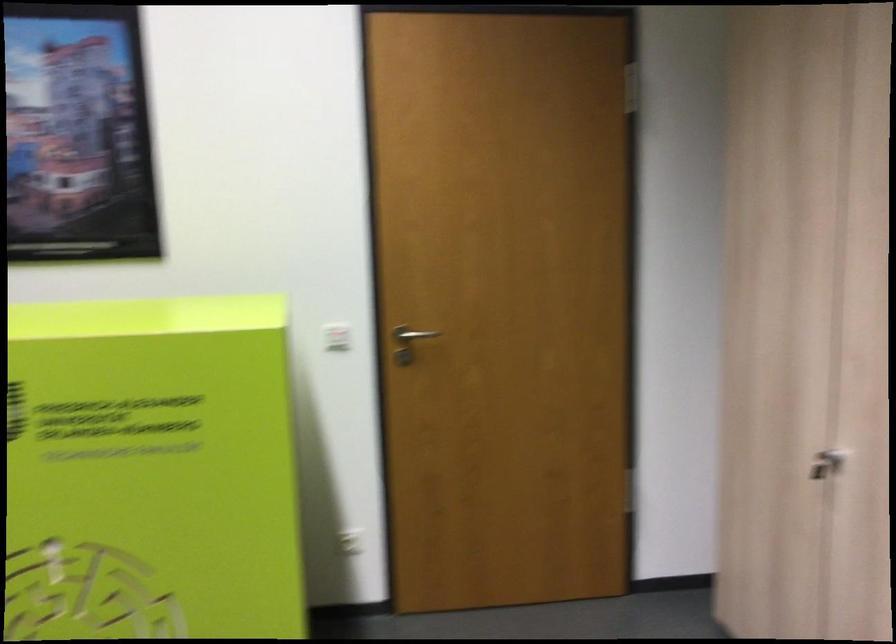
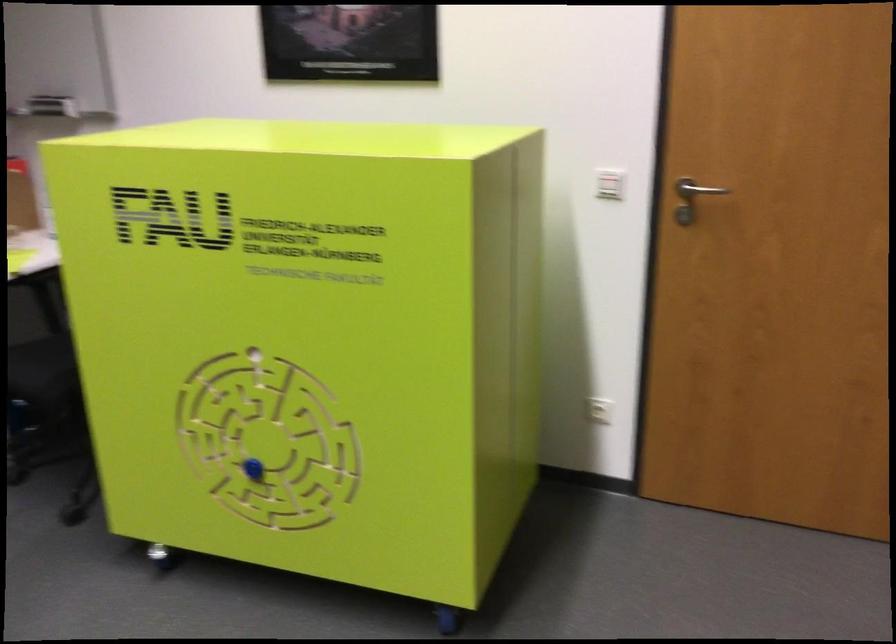
Where in the second image is the point corresponding to point (409, 330) from the first image?

(694, 190)